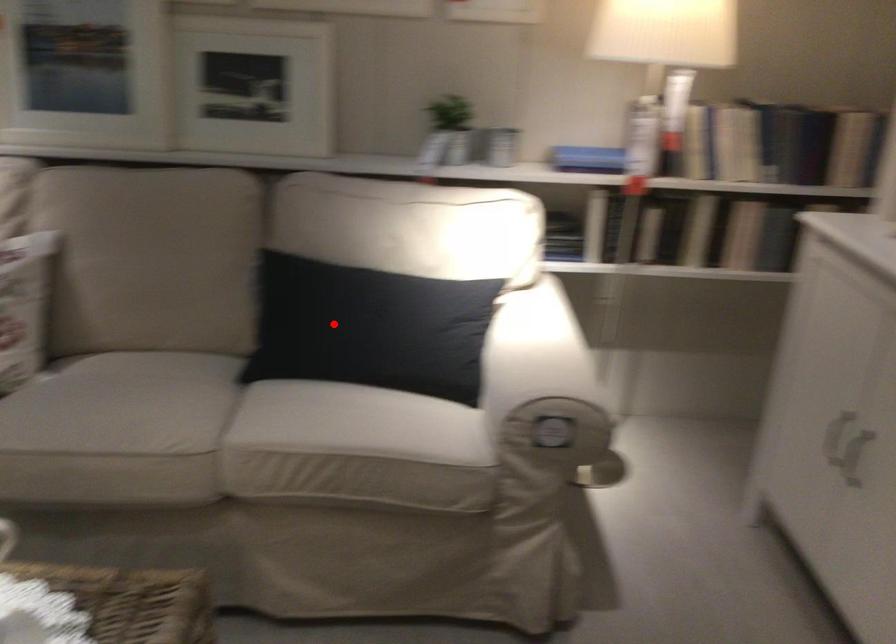
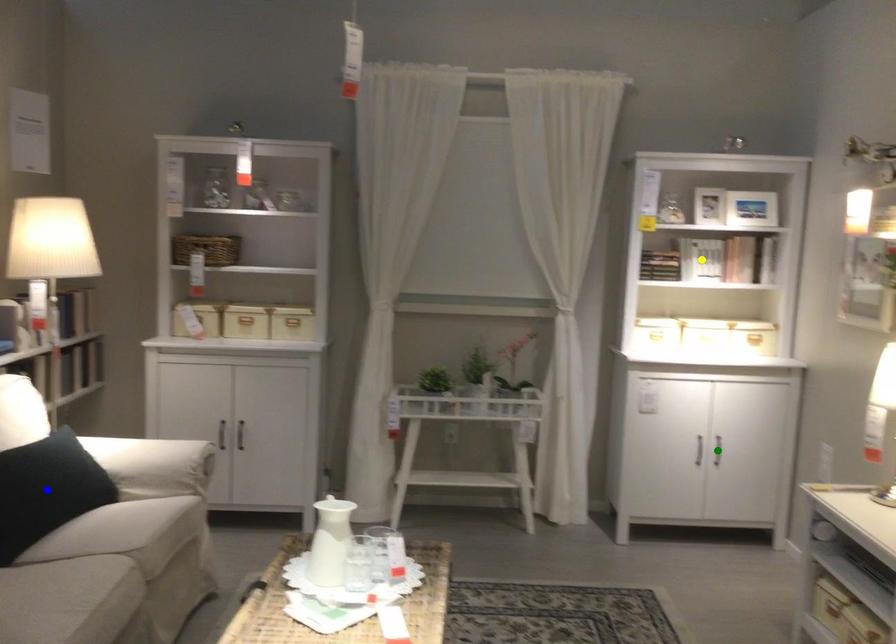
Question: I am providing you with two images of the same scene from different viewpoints. A red point is marked on the first image. You are given multiple points on the second image. Can you choose the point in image 2 that corresponds to the point in image 1?

Choices:
 (A) blue point
 (B) green point
 (C) yellow point

Answer: (A)